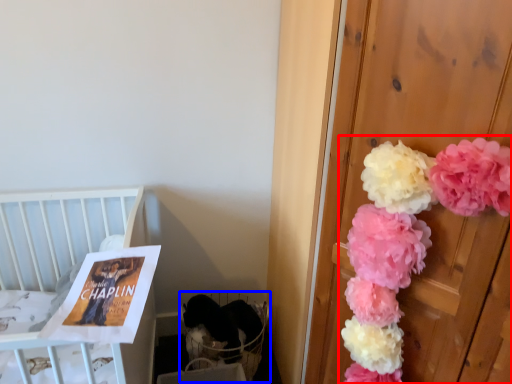
Question: Which point is further to the camera, floral arrangement (highlighted by a red box) or baby carriage (highlighted by a blue box)?

Choices:
 (A) floral arrangement
 (B) baby carriage

Answer: (B)